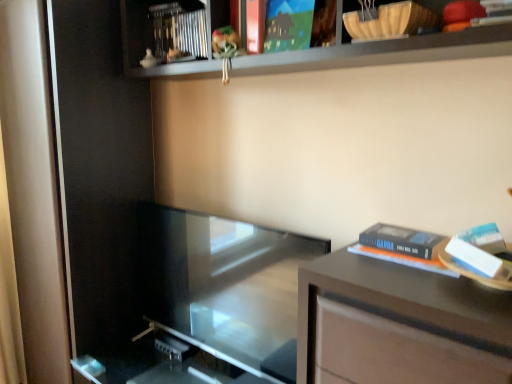
The width and height of the screenshot is (512, 384). Describe the element at coordinates (404, 259) in the screenshot. I see `hardcover book at right, the 1th paperback book viewed from the right` at that location.

This screenshot has width=512, height=384. Describe the element at coordinates (100, 171) in the screenshot. I see `transparent glass screen door at left, positioned as the 1th screen door in right-to-left order` at that location.

Identify the location of matte brown table at right. (405, 322).

Locate an element on the screen. matte paper at upper center, the first paperback book viewed from the left is located at coordinates (288, 25).

What is the approximate width of wooden shelf at upper center?

The width of wooden shelf at upper center is 10.70 inches.

This screenshot has width=512, height=384. Find the location of `transparent glass door at center`. transparent glass door at center is located at coordinates (224, 286).

What are the coordinates of `hardcover book at right, the second paperback book when ordered from top to bottom` in the screenshot? It's located at (404, 259).

Looking at this image, from the image's perspective, is transparent glass door at center above or below matte brown table at right?

Clearly, from the image's perspective, transparent glass door at center is above matte brown table at right.

From a real-world perspective, is transparent glass door at center above or below matte brown table at right?

In terms of real-world spatial position, transparent glass door at center is below matte brown table at right.

Which object is wider, transparent glass door at center or matte brown table at right?

matte brown table at right is wider.

From the picture: Is transparent glass door at center turned away from matte brown table at right?

No, transparent glass door at center is not facing the opposite direction of matte brown table at right.

Is metallic silver book at upper center bigger than matte brown table at right?

Incorrect, metallic silver book at upper center is not larger than matte brown table at right.

From the image's perspective, is metallic silver book at upper center positioned above or below matte brown table at right?

metallic silver book at upper center is situated higher than matte brown table at right in the image.

Would you consider metallic silver book at upper center to be distant from matte brown table at right?

Yes.

Is metallic silver book at upper center looking in the opposite direction of matte brown table at right?

That's not correct — metallic silver book at upper center is not looking away from matte brown table at right.

Which is nearer, (99, 101) or (475, 320)?

The point (475, 320) is in front.

Find the location of a particular element. The image size is (512, 384). table in front of the transparent glass screen door at left, positioned as the 1th screen door in right-to-left order is located at coordinates (405, 322).

From a real-world perspective, does transparent glass screen door at left, placed as the second screen door when sorted from left to right, sit lower than matte brown table at right?

No, from a real-world perspective, transparent glass screen door at left, placed as the second screen door when sorted from left to right, is not under matte brown table at right.

Is hardcover book at right, the 1th paperback book ordered from the bottom, facing away from matte paper at upper center, the first paperback book when ordered from top to bottom?

hardcover book at right, the 1th paperback book ordered from the bottom, does not have its back to matte paper at upper center, the first paperback book when ordered from top to bottom.

Are hardcover book at right, the 1th paperback book viewed from the right, and matte paper at upper center, the first paperback book viewed from the left, located far from each other?

No.

Which object is more forward, hardcover book at right, the second paperback book when ordered from top to bottom, or matte paper at upper center, positioned as the 2th paperback book in bottom-to-top order?

hardcover book at right, the second paperback book when ordered from top to bottom.

From a real-world perspective, is hardcover book at right, which ranks as the 2th paperback book in left-to-right order, above or below matte paper at upper center, positioned as the 2th paperback book in bottom-to-top order?

hardcover book at right, which ranks as the 2th paperback book in left-to-right order, is situated lower than matte paper at upper center, positioned as the 2th paperback book in bottom-to-top order, in the real world.

Starting from the matte white screen door at left, which is counted as the second screen door, starting from the right, which paperback book is the 1st one to the right? Please provide its 2D coordinates.

[(288, 25)]

Is matte paper at upper center, the first paperback book when ordered from top to bottom, wider or thinner than matte white screen door at left, which is counted as the second screen door, starting from the right?

Considering their sizes, matte paper at upper center, the first paperback book when ordered from top to bottom, looks slimmer than matte white screen door at left, which is counted as the second screen door, starting from the right.

Could you tell me if matte paper at upper center, the first paperback book when ordered from top to bottom, is facing matte white screen door at left, which is counted as the second screen door, starting from the right?

No, matte paper at upper center, the first paperback book when ordered from top to bottom, is not oriented towards matte white screen door at left, which is counted as the second screen door, starting from the right.

From the image's perspective, which one is positioned higher, matte paper at upper center, the first paperback book when ordered from top to bottom, or matte white screen door at left, which is counted as the second screen door, starting from the right?

matte paper at upper center, the first paperback book when ordered from top to bottom, is shown above in the image.

Considering the points (316, 346) and (282, 255), which point is behind, point (316, 346) or point (282, 255)?

Positioned behind is point (282, 255).

Can you confirm if matte brown table at right is positioned to the right of transparent glass door at center?

Correct, you'll find matte brown table at right to the right of transparent glass door at center.

From a real-world perspective, who is located higher, matte brown table at right or transparent glass door at center?

matte brown table at right is physically above.

From the image's perspective, which is below, matte brown table at right or transparent glass door at center?

matte brown table at right is shown below in the image.

Is wooden shelf at upper center beside hardcover book at right, which ranks as the 2th paperback book in left-to-right order?

They are not placed beside each other.

Does wooden shelf at upper center turn towards hardcover book at right, the 1th paperback book ordered from the bottom?

No, wooden shelf at upper center is not turned towards hardcover book at right, the 1th paperback book ordered from the bottom.

Where is `shelf lying above the hardcover book at right, which ranks as the 2th paperback book in left-to-right order (from the image's perspective)`? Image resolution: width=512 pixels, height=384 pixels. shelf lying above the hardcover book at right, which ranks as the 2th paperback book in left-to-right order (from the image's perspective) is located at coordinates (383, 52).

Considering the sizes of objects wooden shelf at upper center and hardcover book at right, the 1th paperback book ordered from the bottom, in the image provided, who is bigger, wooden shelf at upper center or hardcover book at right, the 1th paperback book ordered from the bottom,?

Bigger between the two is wooden shelf at upper center.

Image resolution: width=512 pixels, height=384 pixels. I want to click on glass door that is under the matte brown table at right (from a real-world perspective), so click(224, 286).

The image size is (512, 384). I want to click on book behind the matte brown table at right, so click(x=179, y=31).

Based on their spatial positions, is metallic silver book at upper center or matte white screen door at left, which is counted as the second screen door, starting from the right, closer to wooden shelf at upper center?

metallic silver book at upper center is closer to wooden shelf at upper center.

Looking at the image, which one is located further to transparent glass door at center, transparent glass screen door at left, positioned as the 1th screen door in right-to-left order, or wooden shelf at upper center?

wooden shelf at upper center is further to transparent glass door at center.

Considering their positions, is hardcover book at right, the 1th paperback book viewed from the right, positioned further to transparent glass screen door at left, positioned as the 1th screen door in right-to-left order, than metallic silver book at upper center?

hardcover book at right, the 1th paperback book viewed from the right.

Which object lies nearer to the anchor point matte brown table at right, matte white screen door at left, the first screen door positioned from the left, or metallic silver book at upper center?

metallic silver book at upper center.

Based on their spatial positions, is transparent glass screen door at left, placed as the second screen door when sorted from left to right, or metallic silver book at upper center further from matte white screen door at left, which is counted as the second screen door, starting from the right?

metallic silver book at upper center is further to matte white screen door at left, which is counted as the second screen door, starting from the right.

Estimate the real-world distances between objects in this image. Which object is further from wooden shelf at upper center, transparent glass screen door at left, positioned as the 1th screen door in right-to-left order, or matte white screen door at left, the first screen door positioned from the left?

matte white screen door at left, the first screen door positioned from the left, is positioned further to the anchor wooden shelf at upper center.

Looking at the image, which one is located closer to transparent glass door at center, wooden shelf at upper center or transparent glass screen door at left, positioned as the 1th screen door in right-to-left order?

Based on the image, transparent glass screen door at left, positioned as the 1th screen door in right-to-left order, appears to be nearer to transparent glass door at center.

When comparing their distances from transparent glass screen door at left, positioned as the 1th screen door in right-to-left order, does transparent glass door at center or matte brown table at right seem closer?

Based on the image, transparent glass door at center appears to be nearer to transparent glass screen door at left, positioned as the 1th screen door in right-to-left order.

At what (x,y) coordinates should I click in order to perform the action: click on screen door between matte white screen door at left, which is counted as the second screen door, starting from the right, and matte paper at upper center, the first paperback book viewed from the left, from left to right. Please return your answer as a coordinate pair (x, y). This screenshot has width=512, height=384. Looking at the image, I should click on (100, 171).

Find the location of `glass door situated between matte white screen door at left, which is counted as the second screen door, starting from the right, and matte paper at upper center, the first paperback book viewed from the left, from left to right`. glass door situated between matte white screen door at left, which is counted as the second screen door, starting from the right, and matte paper at upper center, the first paperback book viewed from the left, from left to right is located at coordinates (224, 286).

Identify the location of shelf located between matte white screen door at left, which is counted as the second screen door, starting from the right, and matte paper at upper center, positioned as the 2th paperback book in bottom-to-top order, in the left-right direction. Image resolution: width=512 pixels, height=384 pixels. (383, 52).

The image size is (512, 384). I want to click on shelf between matte white screen door at left, which is counted as the second screen door, starting from the right, and matte brown table at right from left to right, so click(x=383, y=52).